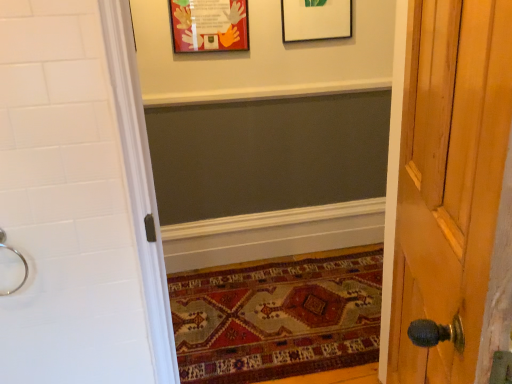
Question: From a real-world perspective, is white matte picture frame at upper center, which ranks as the 1th picture frame in right-to-left order, physically located above or below silver metallic ring at left?

Choices:
 (A) above
 (B) below

Answer: (A)

Question: Looking at their shapes, would you say white matte picture frame at upper center, which is the second picture frame from left to right, is wider or thinner than silver metallic ring at left?

Choices:
 (A) thin
 (B) wide

Answer: (A)

Question: Which is farther from the white matte picture frame at upper center, which is the second picture frame from left to right?

Choices:
 (A) matte cardboard picture frame at upper center, the first picture frame positioned from the left
 (B) silver metallic ring at left
 (C) carpeted mat at lower center

Answer: (B)

Question: Estimate the real-world distances between objects in this image. Which object is farther from the white matte picture frame at upper center, which is the second picture frame from left to right?

Choices:
 (A) matte cardboard picture frame at upper center, acting as the second picture frame starting from the right
 (B) carpeted mat at lower center
 (C) silver metallic ring at left

Answer: (C)